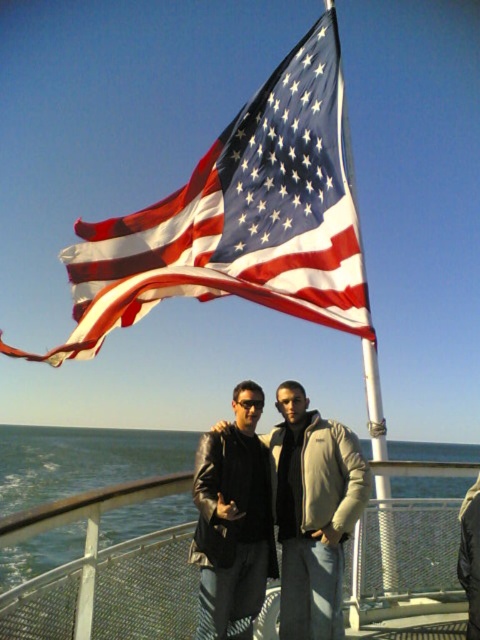
Can you confirm if blue water at lower left is positioned to the right of leather jacket at center?

Incorrect, blue water at lower left is not on the right side of leather jacket at center.

Can you confirm if blue water at lower left is smaller than leather jacket at center?

No.

Find the location of a particular element. blue water at lower left is located at coordinates (81, 461).

Where is `blue water at lower left`? This screenshot has height=640, width=480. blue water at lower left is located at coordinates (81, 461).

Based on the photo, which of these two, american flag at upper center or leather jacket at center, stands shorter?

With less height is leather jacket at center.

Is american flag at upper center above leather jacket at center?

Indeed, american flag at upper center is positioned over leather jacket at center.

Locate an element on the screen. The image size is (480, 640). american flag at upper center is located at coordinates (239, 218).

In order to click on american flag at upper center in this screenshot , I will do `click(239, 218)`.

Between american flag at upper center and matte black leather jacket at center, which one is positioned lower?

Positioned lower is matte black leather jacket at center.

Who is higher up, american flag at upper center or matte black leather jacket at center?

american flag at upper center

Does point (240, 193) come farther from viewer compared to point (331, 467)?

Yes, point (240, 193) is farther from viewer.

The height and width of the screenshot is (640, 480). In order to click on american flag at upper center in this screenshot , I will do `click(239, 218)`.